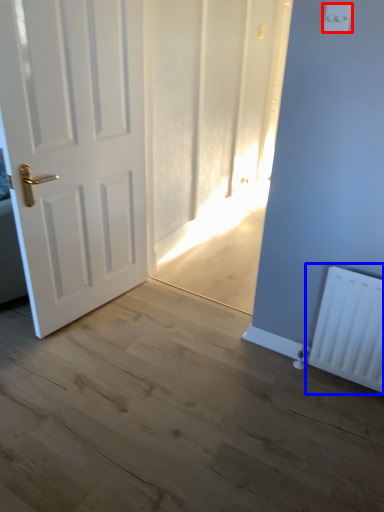
Question: Which point is further to the camera, light switch (highlighted by a red box) or radiator (highlighted by a blue box)?

Choices:
 (A) light switch
 (B) radiator

Answer: (B)